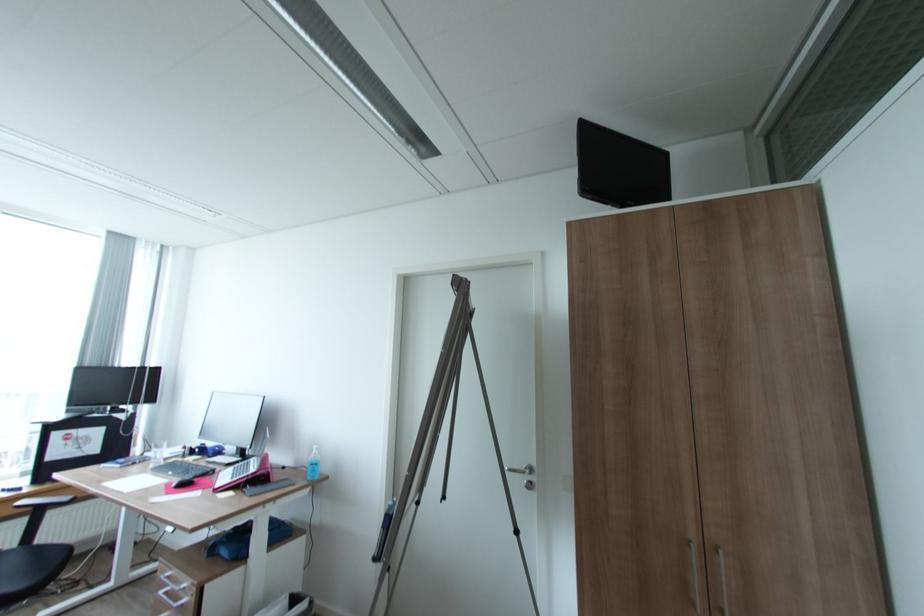
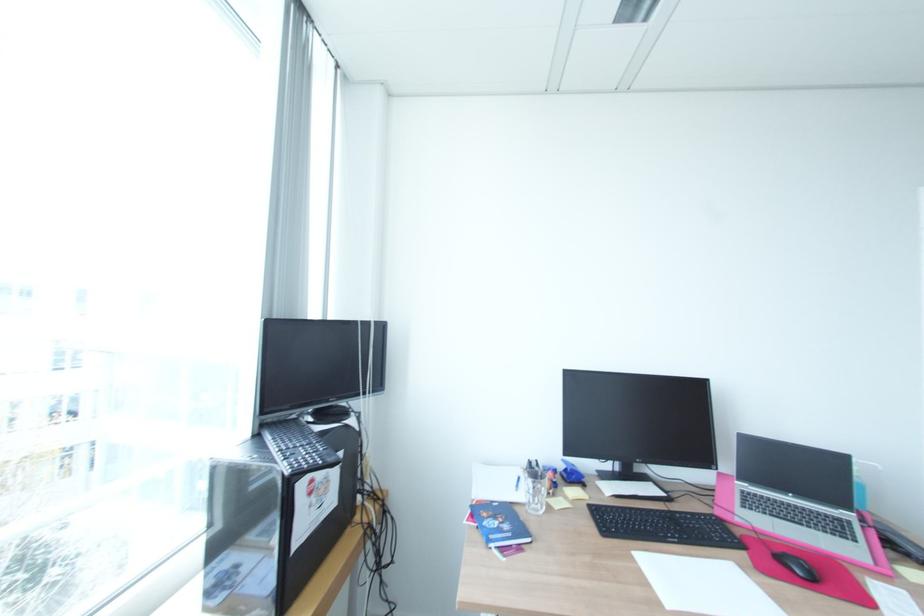
In a continuous first-person perspective shot, in which direction is the camera moving?

The cameraman walked toward left, forward.